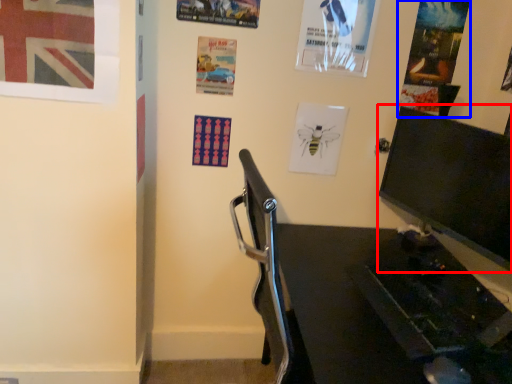
Question: Among these objects, which one is farthest to the camera, computer monitor (highlighted by a red box) or poster page (highlighted by a blue box)?

Choices:
 (A) computer monitor
 (B) poster page

Answer: (B)